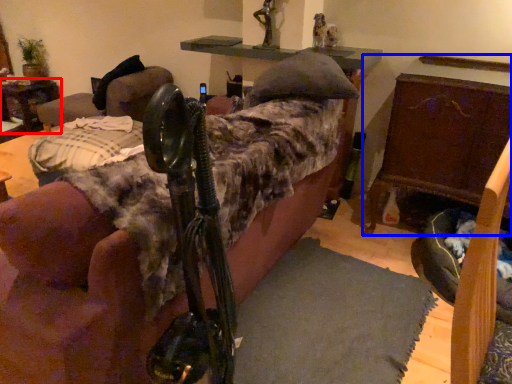
Question: Which object is closer to the camera taking this photo, table (highlighted by a red box) or furniture (highlighted by a blue box)?

Choices:
 (A) table
 (B) furniture

Answer: (B)